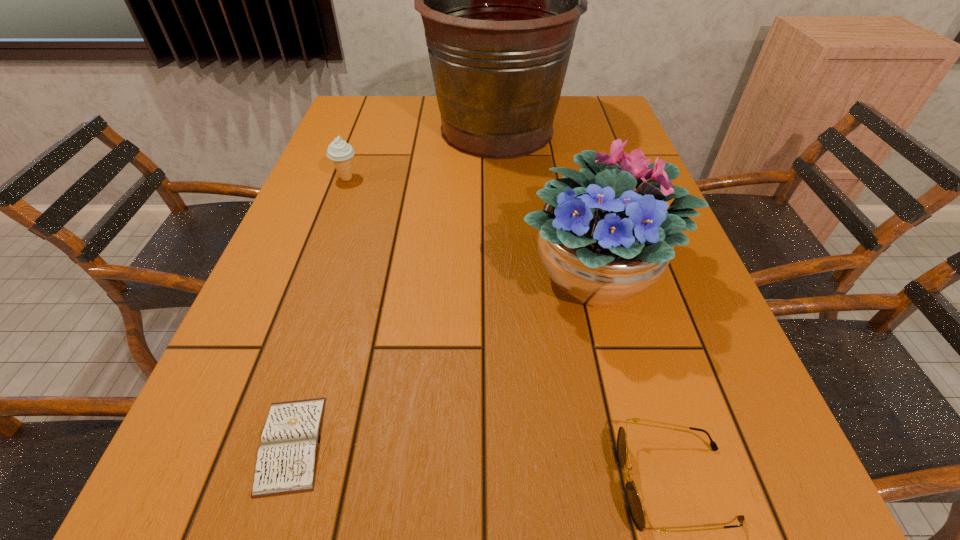
What are the coordinates of `bucket` in the screenshot? It's located at (500, 0).

This screenshot has width=960, height=540. In order to click on the farthest object in this screenshot , I will do `click(500, 0)`.

I want to click on the fourth shortest object, so click(603, 243).

Locate an element on the screen. The image size is (960, 540). bouquet is located at coordinates (603, 243).

Locate an element on the screen. The image size is (960, 540). icecream is located at coordinates (340, 152).

Locate an element on the screen. This screenshot has width=960, height=540. the fourth nearest object is located at coordinates (340, 152).

At what (x,y) coordinates should I click in order to perform the action: click on the shortest object. Please return your answer as a coordinate pair (x, y). Looking at the image, I should click on (286, 462).

Where is `blank area located 0.210m on the left of the bucket`? This screenshot has width=960, height=540. blank area located 0.210m on the left of the bucket is located at coordinates (358, 130).

You are a GUI agent. You are given a task and a screenshot of the screen. Output one action in this format:
    pyautogui.click(x=<x>, y=<y>)
    Task: Click on the vacant area situated 0.350m on the back of the bouquet
    The image size is (960, 540).
    Given the screenshot: What is the action you would take?
    pyautogui.click(x=564, y=147)

I want to click on free space located 0.070m on the right of the icecream, so click(x=386, y=179).